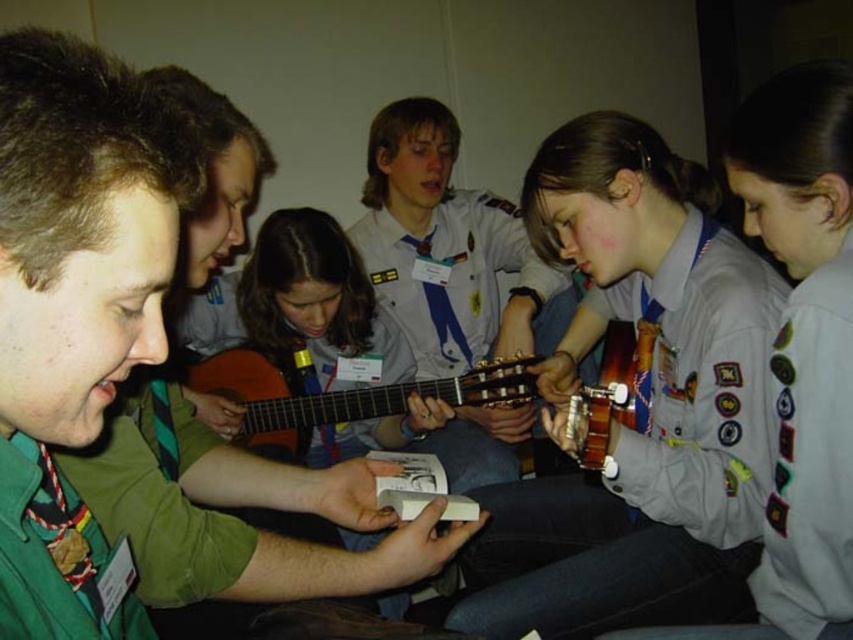
Question: Among these points, which one is farthest from the camera?

Choices:
 (A) (28, 195)
 (B) (263, 252)
 (C) (612, 317)

Answer: (B)

Question: Considering the real-world distances, which object is farthest from the matte brown guitar at center?

Choices:
 (A) matte gray uniform at center
 (B) green uniform shirt at center
 (C) wooden acoustic guitar at center

Answer: (B)

Question: Can you confirm if green uniform shirt at center is positioned to the right of wooden acoustic guitar at center?

Choices:
 (A) no
 (B) yes

Answer: (A)

Question: Can you confirm if green uniform shirt at center is positioned below wooden acoustic guitar at center?

Choices:
 (A) yes
 (B) no

Answer: (B)

Question: Can you confirm if matte gray uniform at center is positioned above wooden acoustic guitar at center?

Choices:
 (A) no
 (B) yes

Answer: (B)

Question: Considering the real-world distances, which object is closest to the matte gray uniform at center?

Choices:
 (A) green uniform shirt at center
 (B) wooden acoustic guitar at center
 (C) matte brown guitar at center
 (D) light gray uniform at center

Answer: (D)